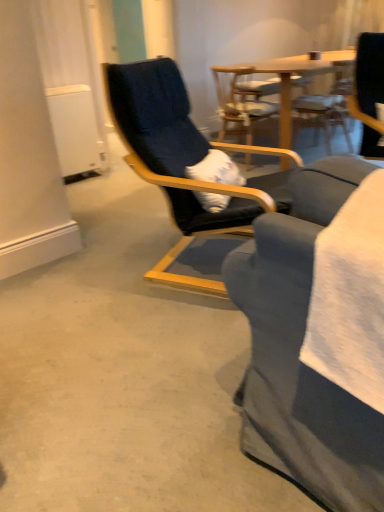
Question: From a real-world perspective, does wooden chair at center, positioned as the 2th chair in back-to-front order, stand above black fabric chair at center, acting as the 3th chair starting from the back?

Choices:
 (A) no
 (B) yes

Answer: (A)

Question: Is wooden chair at center, positioned as the 2th chair in back-to-front order, far from black fabric chair at center, positioned as the first chair in front-to-back order?

Choices:
 (A) yes
 (B) no

Answer: (A)

Question: Can you confirm if wooden chair at center, positioned as the 2th chair in back-to-front order, is shorter than black fabric chair at center, acting as the 3th chair starting from the back?

Choices:
 (A) yes
 (B) no

Answer: (A)

Question: Is wooden chair at center, positioned as the 2th chair in back-to-front order, aimed at black fabric chair at center, positioned as the first chair in front-to-back order?

Choices:
 (A) yes
 (B) no

Answer: (B)

Question: Is wooden chair at center, placed as the second chair when sorted from front to back, next to black fabric chair at center, acting as the 3th chair starting from the back, and touching it?

Choices:
 (A) no
 (B) yes

Answer: (A)

Question: Is wooden chair at center, placed as the second chair when sorted from front to back, wider than black fabric chair at center, acting as the 3th chair starting from the back?

Choices:
 (A) no
 (B) yes

Answer: (A)

Question: From the image's perspective, is wooden chair at center, the 1th chair in the back-to-front sequence, under wooden chair at center, positioned as the 2th chair in back-to-front order?

Choices:
 (A) no
 (B) yes

Answer: (A)

Question: Is wooden chair at center, arranged as the third chair when viewed from the front, smaller than wooden chair at center, positioned as the 2th chair in back-to-front order?

Choices:
 (A) no
 (B) yes

Answer: (A)

Question: Is wooden chair at center, the 1th chair in the back-to-front sequence, closer to the viewer compared to wooden chair at center, positioned as the 2th chair in back-to-front order?

Choices:
 (A) no
 (B) yes

Answer: (A)

Question: Is wooden chair at center, the 1th chair in the back-to-front sequence, not near wooden chair at center, positioned as the 2th chair in back-to-front order?

Choices:
 (A) no
 (B) yes

Answer: (A)

Question: Is wooden chair at center, the 1th chair in the back-to-front sequence, wider than wooden chair at center, positioned as the 2th chair in back-to-front order?

Choices:
 (A) yes
 (B) no

Answer: (B)

Question: Can you confirm if wooden chair at center, the 1th chair in the back-to-front sequence, is thinner than wooden chair at center, positioned as the 2th chair in back-to-front order?

Choices:
 (A) yes
 (B) no

Answer: (A)

Question: Considering the relative sizes of wooden chair at center, positioned as the 2th chair in back-to-front order, and wooden chair at center, the 1th chair in the back-to-front sequence, in the image provided, is wooden chair at center, positioned as the 2th chair in back-to-front order, smaller than wooden chair at center, the 1th chair in the back-to-front sequence,?

Choices:
 (A) no
 (B) yes

Answer: (B)